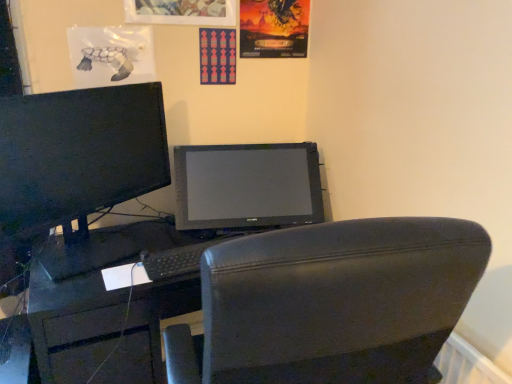
Locate an element on the screen. The width and height of the screenshot is (512, 384). vacant space in black matte keyboard at center (from a real-world perspective) is located at coordinates (180, 258).